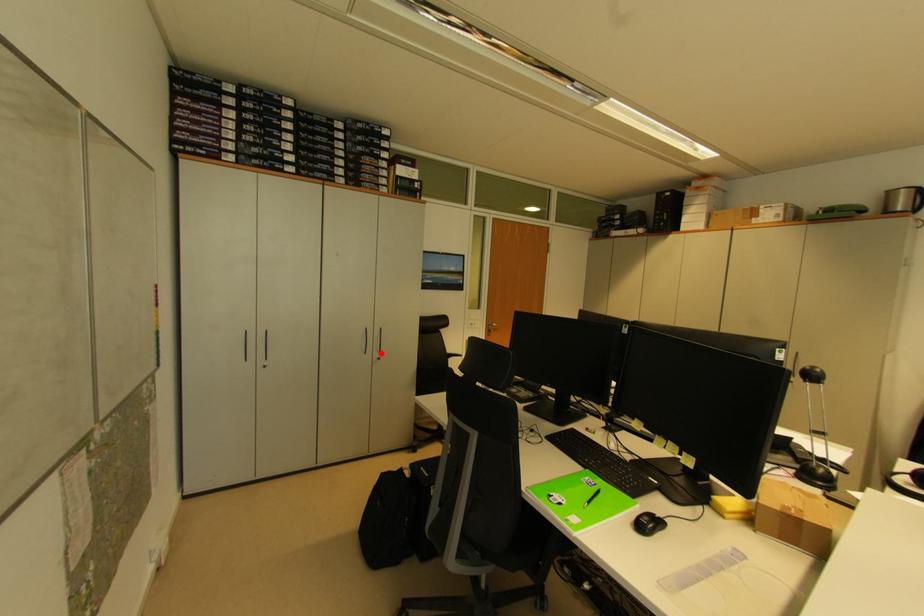
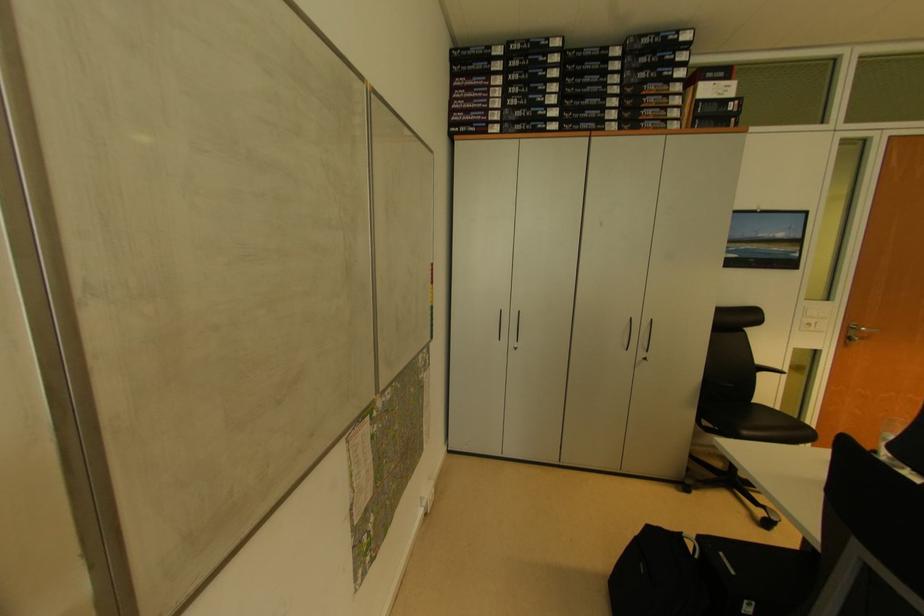
Locate, in the second image, the point that corresponds to the highlighted location in the first image.

(649, 351)